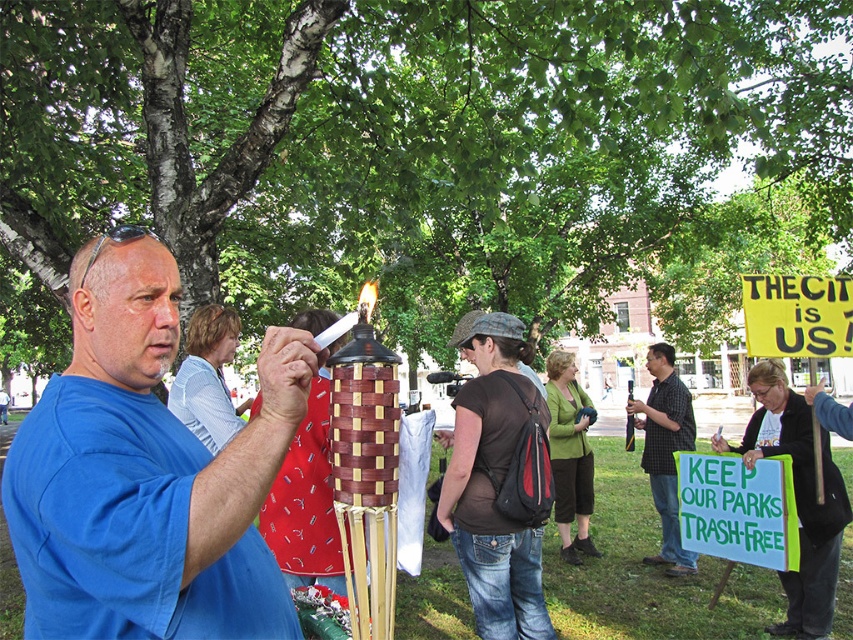
Question: Is blue woven basket at center to the right of checkered fabric shirt at center from the viewer's perspective?

Choices:
 (A) yes
 (B) no

Answer: (B)

Question: Which point is closer to the camera?

Choices:
 (A) checkered fabric shirt at center
 (B) brown fabric backpack at center
 (C) blue woven basket at center

Answer: (C)

Question: Is brown fabric backpack at center to the left of checkered fabric shirt at center from the viewer's perspective?

Choices:
 (A) no
 (B) yes

Answer: (B)

Question: Which of these objects is positioned closest to the checkered fabric shirt at center?

Choices:
 (A) blue woven basket at center
 (B) brown fabric backpack at center

Answer: (B)

Question: Considering the real-world distances, which object is closest to the brown fabric backpack at center?

Choices:
 (A) checkered fabric shirt at center
 (B) blue woven basket at center

Answer: (B)

Question: Can you confirm if blue woven basket at center is thinner than brown fabric backpack at center?

Choices:
 (A) no
 (B) yes

Answer: (A)